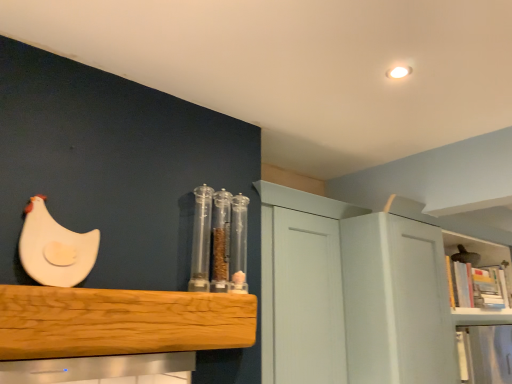
Question: Is wooden bookshelf at upper right, the 1th shelf positioned from the right, far away from natural wood shelf at center, arranged as the 2th shelf when viewed from the right?

Choices:
 (A) no
 (B) yes

Answer: (B)

Question: Is wooden bookshelf at upper right, positioned as the 1th shelf in back-to-front order, aimed at natural wood shelf at center, the first shelf in the front-to-back sequence?

Choices:
 (A) yes
 (B) no

Answer: (B)

Question: From the image's perspective, is wooden bookshelf at upper right, which ranks as the 2th shelf in left-to-right order, located beneath natural wood shelf at center, which ranks as the second shelf in back-to-front order?

Choices:
 (A) no
 (B) yes

Answer: (B)

Question: From the image's perspective, is wooden bookshelf at upper right, the 2th shelf viewed from the front, on natural wood shelf at center, which ranks as the second shelf in back-to-front order?

Choices:
 (A) yes
 (B) no

Answer: (B)

Question: Does wooden bookshelf at upper right, which ranks as the 2th shelf in left-to-right order, come behind natural wood shelf at center, the first shelf in the front-to-back sequence?

Choices:
 (A) no
 (B) yes

Answer: (B)

Question: Does wooden bookshelf at upper right, the 1th shelf positioned from the right, have a greater width compared to natural wood shelf at center, arranged as the 2th shelf when viewed from the right?

Choices:
 (A) yes
 (B) no

Answer: (A)

Question: Does transparent plastic containers at center come in front of wooden bookshelf at upper right, the 1th shelf positioned from the right?

Choices:
 (A) yes
 (B) no

Answer: (A)

Question: Is transparent plastic containers at center with wooden bookshelf at upper right, the 1th shelf positioned from the right?

Choices:
 (A) no
 (B) yes

Answer: (A)

Question: Is transparent plastic containers at center taller than wooden bookshelf at upper right, which ranks as the 2th shelf in left-to-right order?

Choices:
 (A) yes
 (B) no

Answer: (A)

Question: Does transparent plastic containers at center appear on the left side of wooden bookshelf at upper right, which ranks as the 2th shelf in left-to-right order?

Choices:
 (A) yes
 (B) no

Answer: (A)

Question: Is wooden bookshelf at upper right, the 1th shelf positioned from the right, completely or partially inside transparent plastic containers at center?

Choices:
 (A) no
 (B) yes

Answer: (A)

Question: Does transparent plastic containers at center have a lesser height compared to wooden bookshelf at upper right, which ranks as the 2th shelf in left-to-right order?

Choices:
 (A) no
 (B) yes

Answer: (A)

Question: Would you say transparent plastic containers at center is a long distance from white matte chicken at left, which is the 1th chicken in left-to-right order?

Choices:
 (A) no
 (B) yes

Answer: (A)